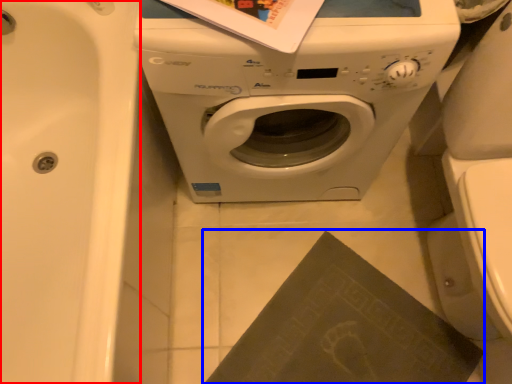
Question: Which of the following is the closest to the observer, bath (highlighted by a red box) or paperback book (highlighted by a blue box)?

Choices:
 (A) bath
 (B) paperback book

Answer: (A)